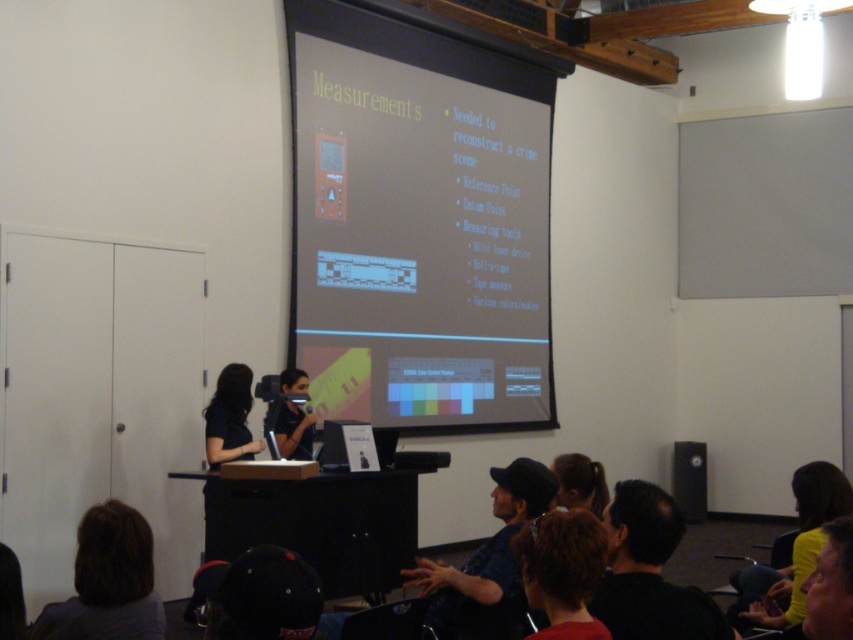
Question: Which is farther from the smooth red shirt at lower center?

Choices:
 (A) dark blue denim jacket at lower center
 (B) brown hair at lower left

Answer: (B)

Question: Is brown hair at lower left positioned behind blonde hair at center?

Choices:
 (A) no
 (B) yes

Answer: (A)

Question: Which of the following is the closest to the observer?

Choices:
 (A) smooth red shirt at lower center
 (B) black matte hair at lower right
 (C) blonde hair at center
 (D) dark blue denim jacket at lower center

Answer: (A)

Question: Considering the real-world distances, which object is closest to the matte black laptop at center?

Choices:
 (A) blonde hair at center
 (B) brown hair at lower left
 (C) yellow matte shirt at lower right

Answer: (A)

Question: Does black matte hair at lower right have a greater width compared to dark blue denim jacket at lower center?

Choices:
 (A) no
 (B) yes

Answer: (A)

Question: Observing the image, what is the correct spatial positioning of black matte shirt at center in reference to black matte speaker at lower right?

Choices:
 (A) above
 (B) below

Answer: (A)